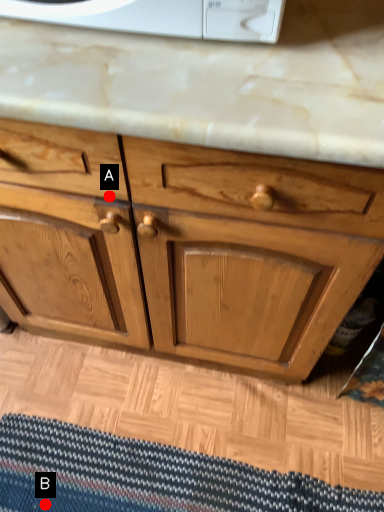
Question: Two points are circled on the image, labeled by A and B beside each circle. Among these points, which one is nearest to the camera?

Choices:
 (A) A is closer
 (B) B is closer

Answer: (A)